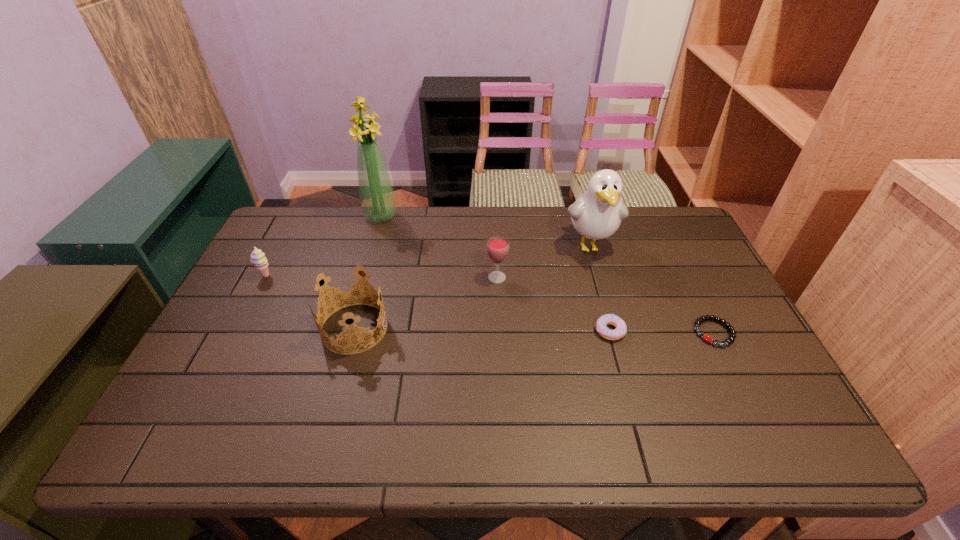
What are the coordinates of `vacant space in between the sherbert and the second tallest object` in the screenshot? It's located at (428, 261).

Locate an element on the screen. This screenshot has height=540, width=960. unoccupied area between the crown and the sixth tallest object is located at coordinates (482, 329).

Locate an element on the screen. vacant area between the sherbert and the bouquet is located at coordinates (324, 246).

At what (x,y) coordinates should I click in order to perform the action: click on vacant area that lies between the second tallest object and the shortest object. Please return your answer as a coordinate pair (x, y). Looking at the image, I should click on (652, 289).

Locate an element on the screen. Image resolution: width=960 pixels, height=540 pixels. blank region between the sherbert and the shortest object is located at coordinates (490, 305).

What are the coordinates of `object that is the sixth closest one to the rightmost object` in the screenshot? It's located at (258, 258).

The width and height of the screenshot is (960, 540). I want to click on object that is the second closest to the crown, so click(497, 246).

Where is `vacant space that satisfies the following two spatial constraints: 1. on the front side of the crown; 2. on the right side of the bracelet`? This screenshot has width=960, height=540. vacant space that satisfies the following two spatial constraints: 1. on the front side of the crown; 2. on the right side of the bracelet is located at coordinates (353, 333).

You are a GUI agent. You are given a task and a screenshot of the screen. Output one action in this format:
    pyautogui.click(x=<x>, y=<y>)
    Task: Click on the free space that satisfies the following two spatial constraints: 1. on the front-facing side of the tallest object; 2. on the right side of the crown
    
    Given the screenshot: What is the action you would take?
    pyautogui.click(x=349, y=328)